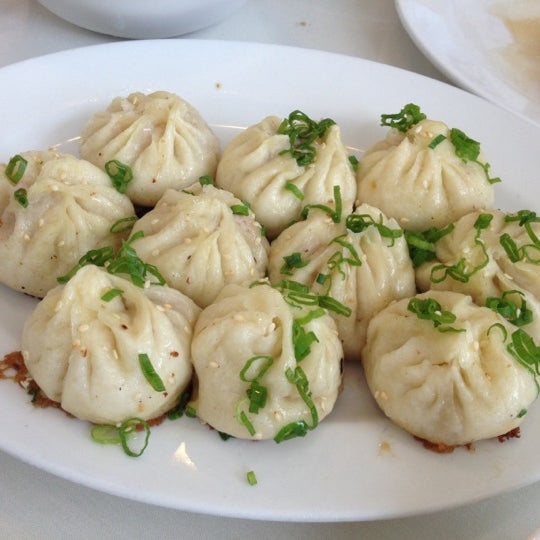
Locate an element on the screen. Image resolution: width=540 pixels, height=540 pixels. plate is located at coordinates (501, 43), (347, 86).